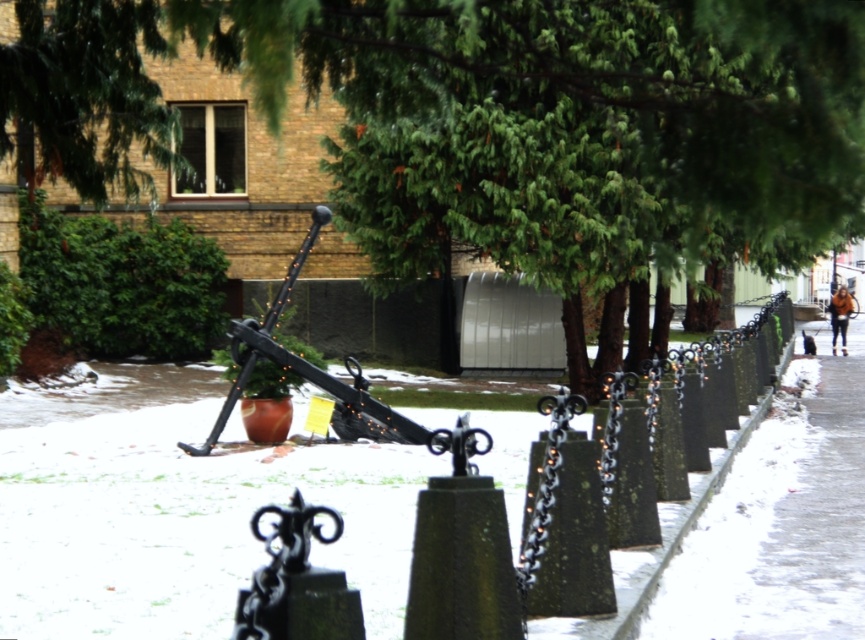
You are standing at the edge of the snowy area and want to walk to the brown leather jacket at right. Is the slick concrete sidewalk at lower right between you and the jacket?

Yes, the slick concrete sidewalk at lower right is between you and the brown leather jacket at right because it is closer to the viewer than the jacket.

You are standing in the snowy park and want to reach the anchor with lights. You see two points marked on the ground. Which point is closer to you, point at coordinate (676, 211) or point at coordinate (849, 298)?

Point at coordinate (676, 211) is closer to the viewer than point at coordinate (849, 298).

You are standing at the center of the snowy park and want to find the green textured tree at center. According to the coordinates given, in which direction should you move to locate it?

The green textured tree at center is located at coordinates point (492,120). Since you are at the center, you should move towards the lower left direction to reach it.